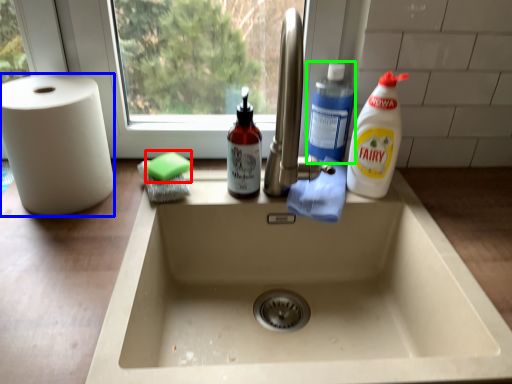
Question: Which object is positioned farthest from soap (highlighted by a red box)? Select from paper towel (highlighted by a blue box) and cleaning product (highlighted by a green box).

Choices:
 (A) paper towel
 (B) cleaning product

Answer: (B)